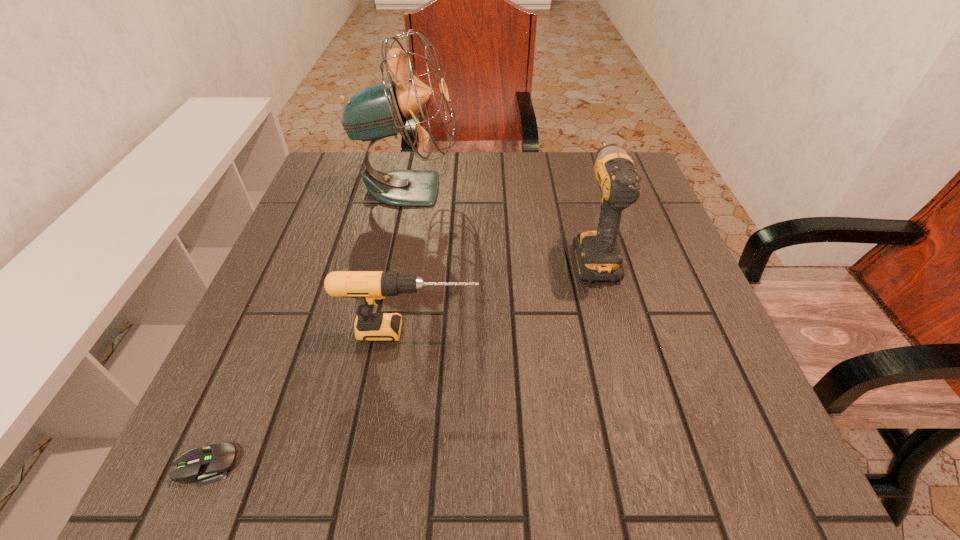
Find the location of `fan`. fan is located at coordinates (381, 110).

This screenshot has height=540, width=960. I want to click on the tallest object, so click(381, 110).

The image size is (960, 540). Identify the location of the taller drill. (597, 254).

Where is `the right drill`? This screenshot has width=960, height=540. the right drill is located at coordinates (597, 254).

Image resolution: width=960 pixels, height=540 pixels. I want to click on the third farthest object, so click(x=370, y=288).

The width and height of the screenshot is (960, 540). Find the location of `the shorter drill`. the shorter drill is located at coordinates (370, 288).

The image size is (960, 540). I want to click on the shortest object, so click(210, 464).

Find the location of a particular element. The height and width of the screenshot is (540, 960). the nearest object is located at coordinates click(210, 464).

The image size is (960, 540). Find the location of `free space located on the front-facing side of the farthest object for air flow`. free space located on the front-facing side of the farthest object for air flow is located at coordinates (478, 188).

Where is `free space located with the drill bit of the taller drill facing forward`? This screenshot has height=540, width=960. free space located with the drill bit of the taller drill facing forward is located at coordinates (576, 190).